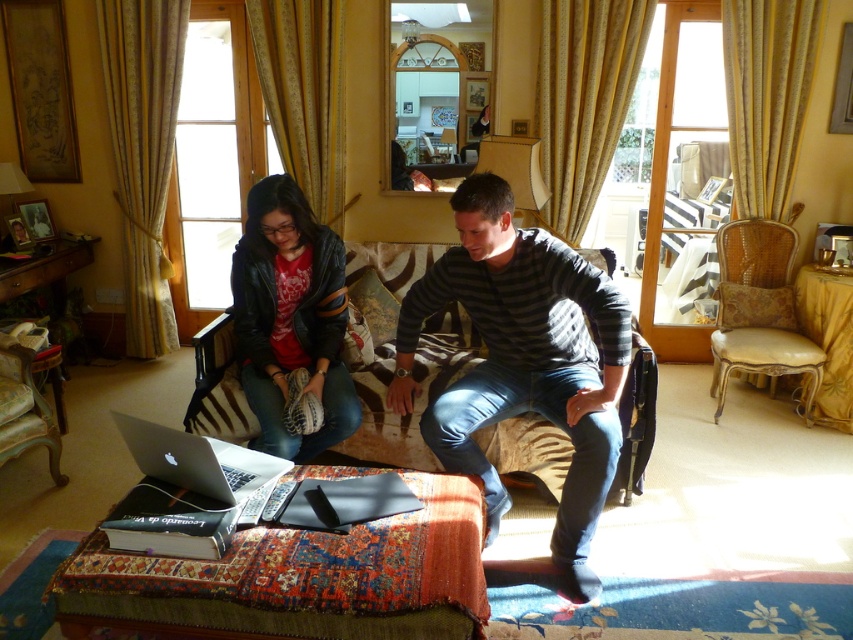
You are a guest entering the living room and want to sit in the most comfortable chair. The light brown leather armchair at right has a firm cushion, while the vintage upholstered armchair at lower left has a softer cushion. Which chair should you choose if you prefer a softer seat?

The vintage upholstered armchair at lower left has a softer cushion, so you should choose it for a softer seat.

You are organizing a small gathering in this living room and need to place a rectangular table that measures 1.2 meters in length. You have to decide between placing it between the leather jacket at center and the light brown leather armchair at right. Based on their sizes, which object should the table be placed closer to?

The table should be placed closer to the light brown leather armchair at right because the leather jacket at center occupies less space, meaning there is more room near the armchair to accommodate the table.

In the scene shown: You are sitting on the sofa and want to move to one of the armchairs. Which armchair, the light brown leather armchair at right or the vintage upholstered armchair at lower left, is closer to you?

The vintage upholstered armchair at lower left is behind the light brown leather armchair at right, so the light brown leather armchair at right is closer to you.